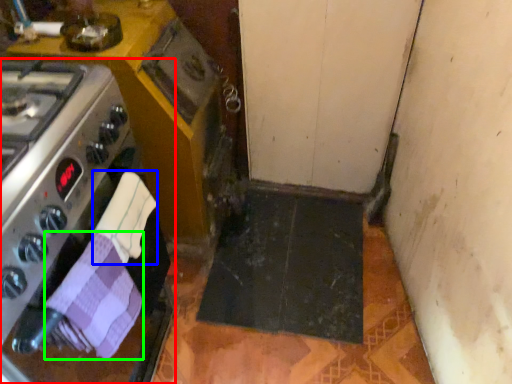
Question: Which object is positioned farthest from kitchen appliance (highlighted by a red box)? Select from hand towel (highlighted by a blue box) and hand towel (highlighted by a green box).

Choices:
 (A) hand towel
 (B) hand towel

Answer: (A)